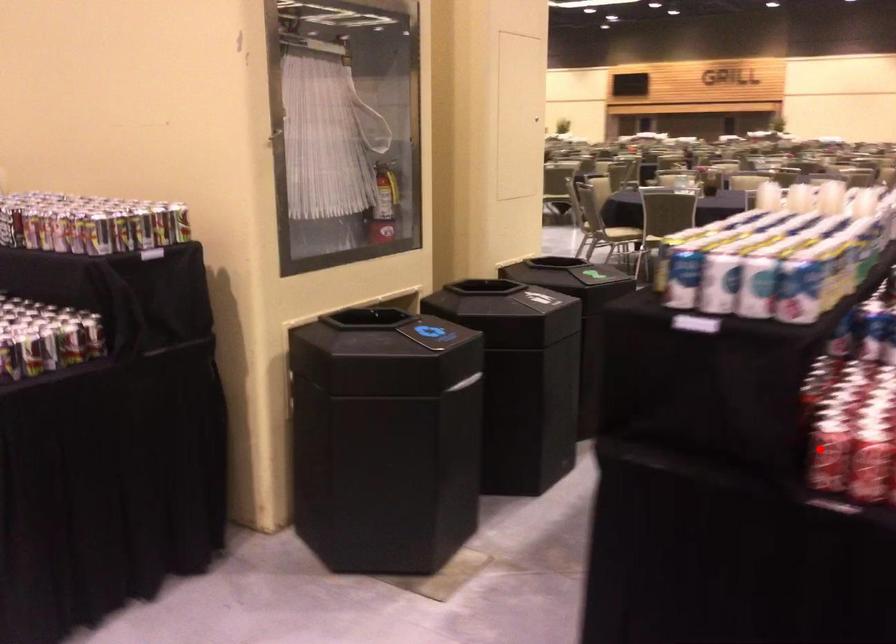
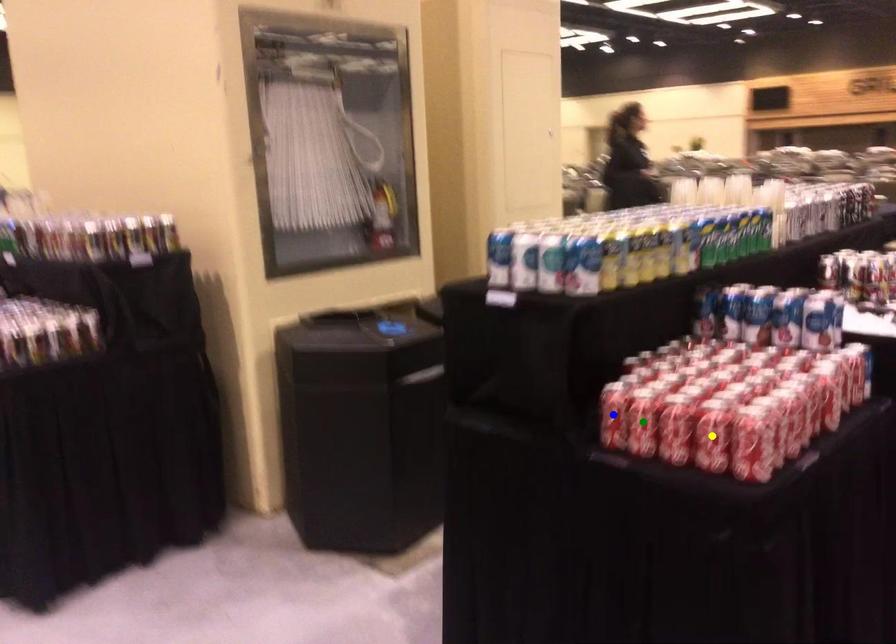
Question: I am providing you with two images of the same scene from different viewpoints. A red point is marked on the first image. You are given multiple points on the second image. Which spot in image 2 lines up with the point in image 1?

Choices:
 (A) yellow point
 (B) green point
 (C) blue point

Answer: (C)